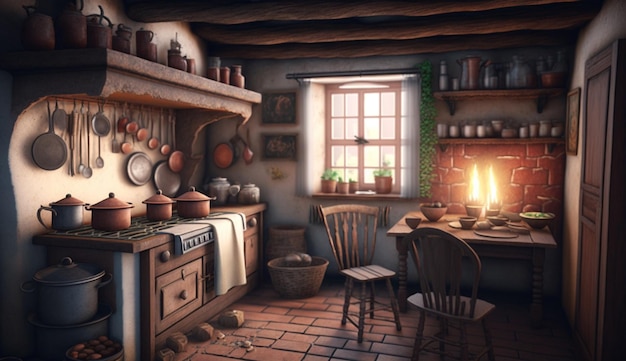
You are a GUI agent. You are given a task and a screenshot of the screen. Output one action in this format:
    pyautogui.click(x=<x>, y=<y>)
    Task: Click on the ceiling
    
    Given the screenshot: What is the action you would take?
    pyautogui.click(x=361, y=37)